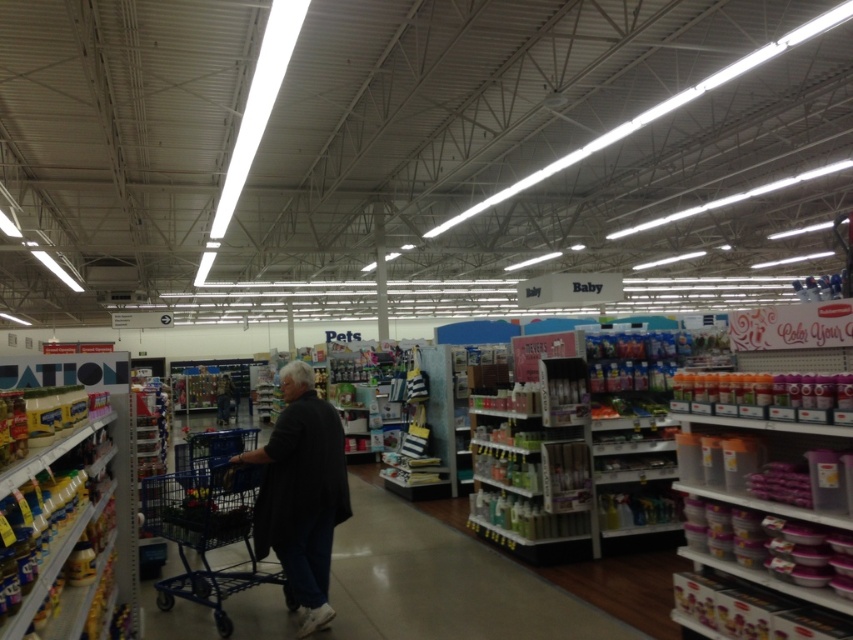
In the scene shown: Can you confirm if metallic yellow canisters at left is positioned to the left of dark gray shirt at center?

Correct, you'll find metallic yellow canisters at left to the left of dark gray shirt at center.

Find the location of a particular element. The width and height of the screenshot is (853, 640). metallic yellow canisters at left is located at coordinates (71, 532).

Where is `metallic yellow canisters at left`? This screenshot has width=853, height=640. metallic yellow canisters at left is located at coordinates (71, 532).

Based on the photo, is blue metal shopping cart at center to the right of black fabric person at center from the viewer's perspective?

Indeed, blue metal shopping cart at center is positioned on the right side of black fabric person at center.

Does blue metal shopping cart at center appear on the left side of black fabric person at center?

Incorrect, blue metal shopping cart at center is not on the left side of black fabric person at center.

Between point (224, 492) and point (219, 396), which one is positioned in front?

Positioned in front is point (224, 492).

Identify the location of blue metal shopping cart at center. The width and height of the screenshot is (853, 640). (209, 522).

Can you confirm if dark gray shirt at center is positioned above blue metal shopping cart at center?

Indeed, dark gray shirt at center is positioned over blue metal shopping cart at center.

What are the coordinates of `dark gray shirt at center` in the screenshot? It's located at pos(300,492).

Is point (311, 493) in front of point (215, 620)?

Yes.

Identify the location of dark gray shirt at center. The width and height of the screenshot is (853, 640). (300, 492).